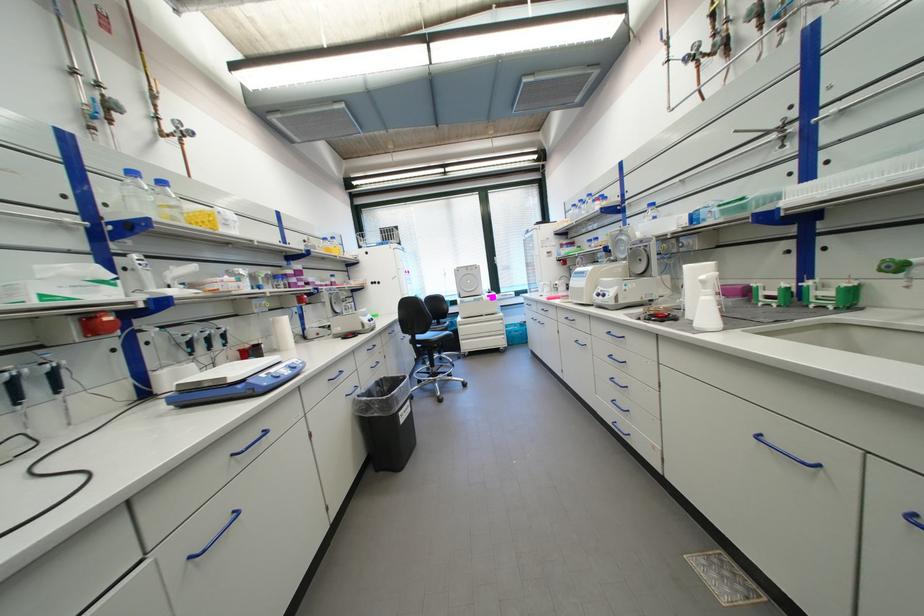
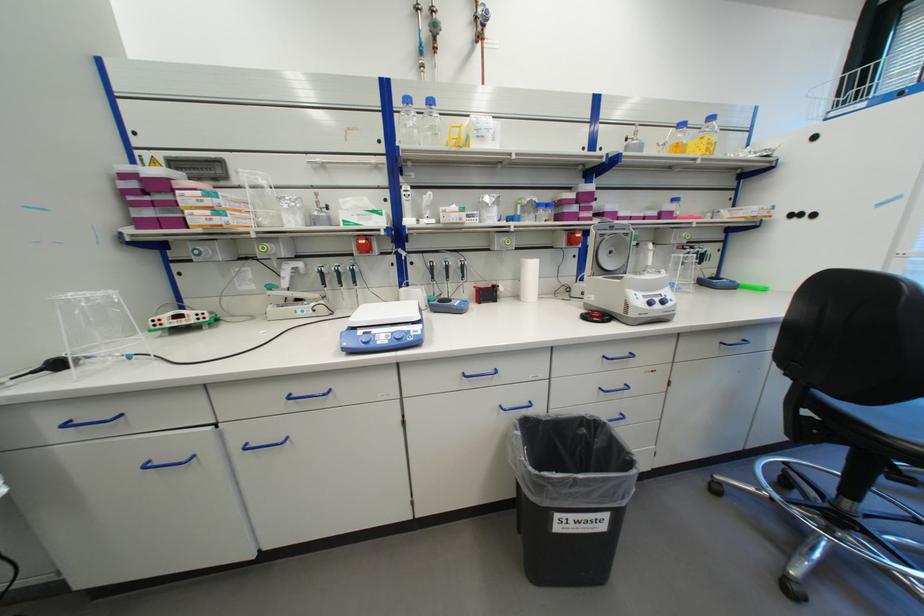
In the second image, find the point that corresponds to [271,376] in the first image.

(369, 333)